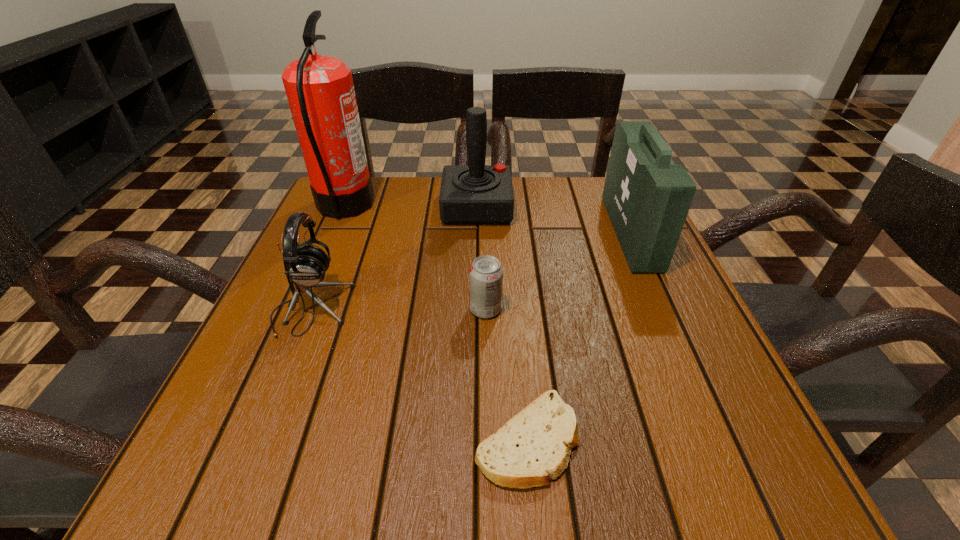
The width and height of the screenshot is (960, 540). Find the location of `free space that satisfies the following two spatial constraints: 1. on the front side of the third shortest object; 2. on the left side of the fire extinguisher`. free space that satisfies the following two spatial constraints: 1. on the front side of the third shortest object; 2. on the left side of the fire extinguisher is located at coordinates (300, 310).

The width and height of the screenshot is (960, 540). I want to click on vacant position in the image that satisfies the following two spatial constraints: 1. on the front side of the shortest object; 2. on the right side of the tallest object, so click(244, 440).

Identify the location of free spot that satisfies the following two spatial constraints: 1. on the front side of the fire extinguisher; 2. on the right side of the soda can. (300, 309).